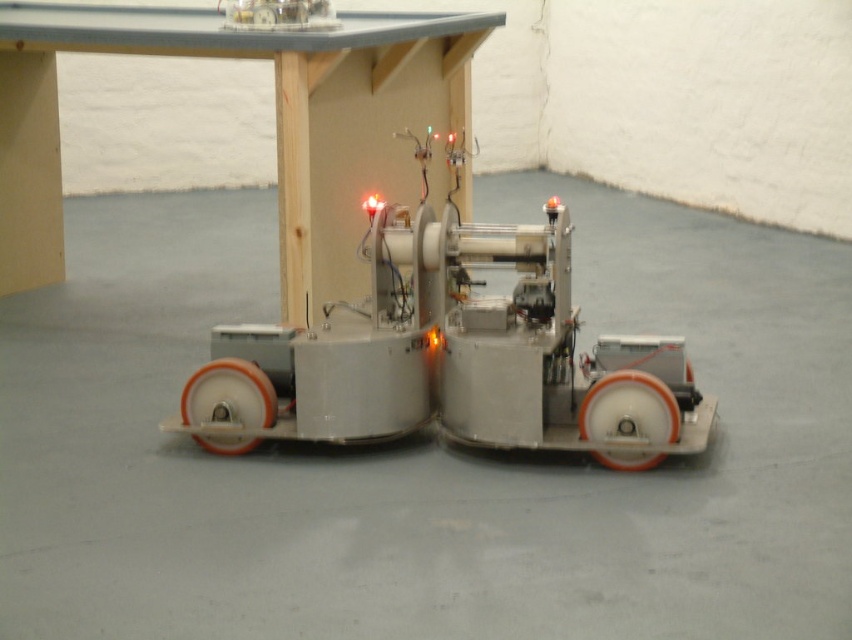
You are operating a small robot with two orange rubber wheels. You notice that the orange rubber wheel at lower right and the orange rubber wheel at lower left are positioned differently. Which wheel is located more to the right side?

The orange rubber wheel at lower right is positioned on the right side of orange rubber wheel at lower left, so the orange rubber wheel at lower right is more to the right.

You are a technician inspecting the metallic robot at center and the orange rubber wheel at lower right. Based on their sizes, which object would require a larger storage container for transport?

The orange rubber wheel at lower right requires a larger storage container because it is bigger than the metallic robot at center.

You are the metallic robot at center and you need to reach the charging station located behind the orange rubber wheel at lower right. Can you move forward to get there?

The metallic robot at center is located below orange rubber wheel at lower right, so it can move forward to reach the charging station behind the orange rubber wheel at lower right.